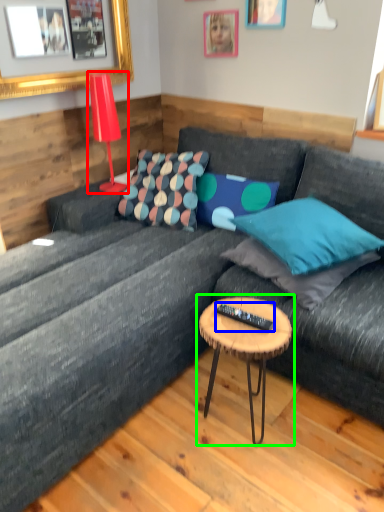
Question: Which object is the farthest from lamp (highlighted by a red box)? Choose among these: remote (highlighted by a blue box) or coffee table (highlighted by a green box).

Choices:
 (A) remote
 (B) coffee table

Answer: (A)